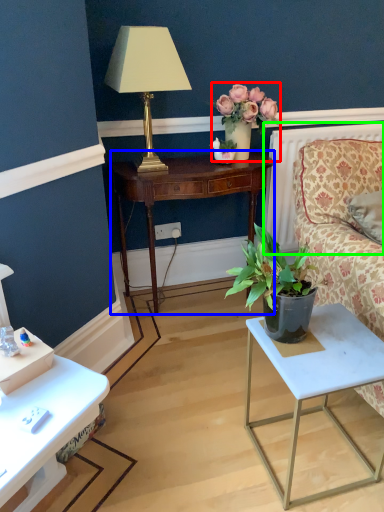
Question: Considering the real-world distances, which object is closest to floral arrangement (highlighted by a red box)? nightstand (highlighted by a blue box) or radiator (highlighted by a green box).

Choices:
 (A) nightstand
 (B) radiator

Answer: (A)